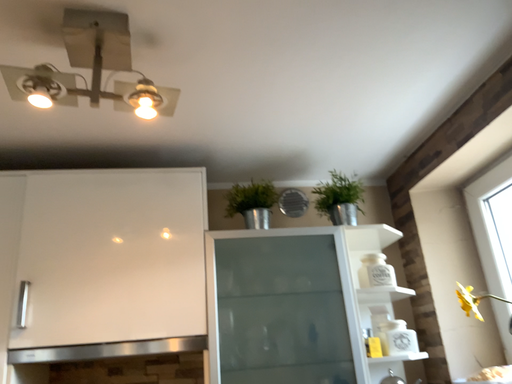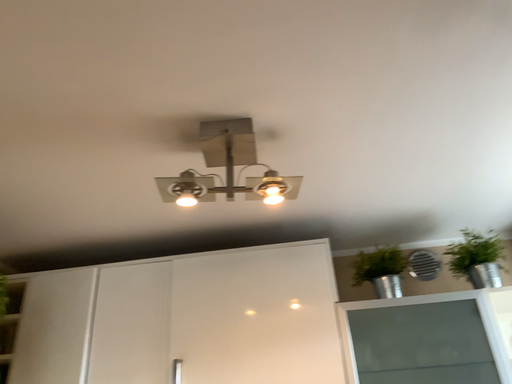
Question: Which way did the camera rotate in the video?

Choices:
 (A) rotated upward
 (B) rotated downward

Answer: (A)